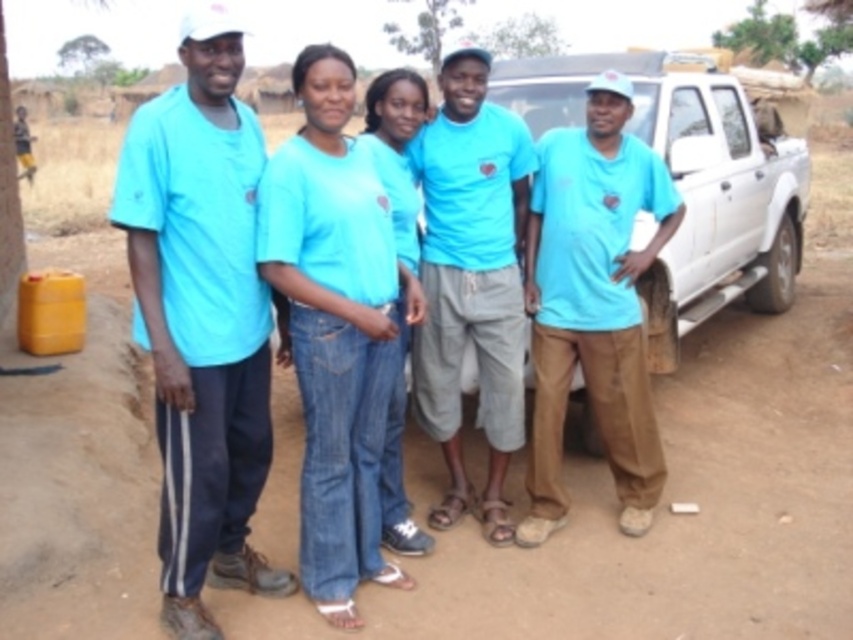
Question: Among these objects, which one is farthest from the camera?

Choices:
 (A) blue denim jeans at center
 (B) matte blue shirt at center
 (C) matte blue t-shirt at center
 (D) matte blue shirt at right

Answer: (D)

Question: Which of these objects is positioned closest to the matte blue shirt at right?

Choices:
 (A) matte blue t-shirt at center
 (B) matte blue shirt at center
 (C) blue denim jeans at center

Answer: (A)

Question: Based on their relative distances, which object is farther from the matte blue t-shirt at center?

Choices:
 (A) blue denim jeans at center
 (B) matte blue shirt at left

Answer: (B)

Question: In this image, where is matte blue shirt at left located relative to matte blue shirt at center?

Choices:
 (A) above
 (B) below

Answer: (A)

Question: Can you confirm if matte blue shirt at left is thinner than matte blue t-shirt at center?

Choices:
 (A) no
 (B) yes

Answer: (B)

Question: Is matte blue shirt at left to the left of blue denim jeans at center from the viewer's perspective?

Choices:
 (A) yes
 (B) no

Answer: (A)